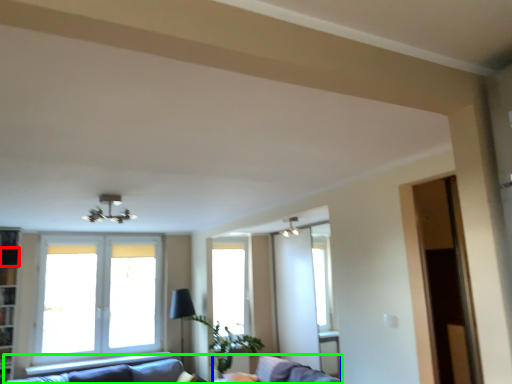
Question: Considering the real-world distances, which object is farthest from shelf (highlighted by a red box)? swivel chair (highlighted by a blue box) or studio couch (highlighted by a green box)?

Choices:
 (A) swivel chair
 (B) studio couch

Answer: (A)